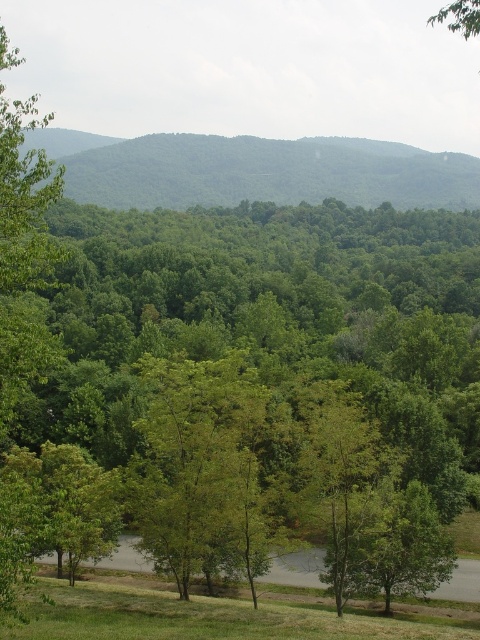
You are standing at the point marked as point (255, 170) in the image. What is the immediate surrounding area like?

The immediate surrounding area around point (255, 170) is green leafy forest at upper center.

You are a hiker standing at the edge of the grassy area in the scene. You want to take a photo of the green leafy tree at center and the green leafy forest at upper center. Which one will appear bigger in the photo?

The green leafy tree at center will appear bigger in the photo because it has a larger size compared to the green leafy forest at upper center.

You are standing in the grassy area and looking towards the forest. Which object is closer to you, the green leafy tree at center or the green leafy forest at upper center?

The green leafy tree at center is closer to you because it is in front of the green leafy forest at upper center.